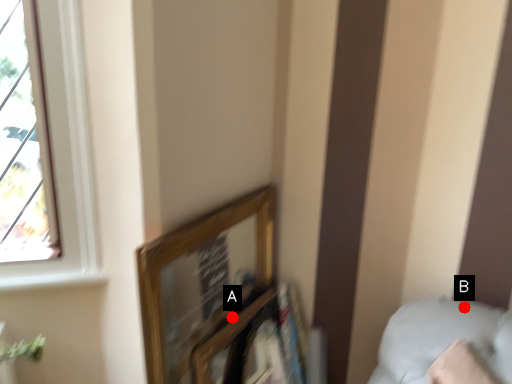
Question: Two points are circled on the image, labeled by A and B beside each circle. Which point is farther from the camera taking this photo?

Choices:
 (A) A is further
 (B) B is further

Answer: (A)